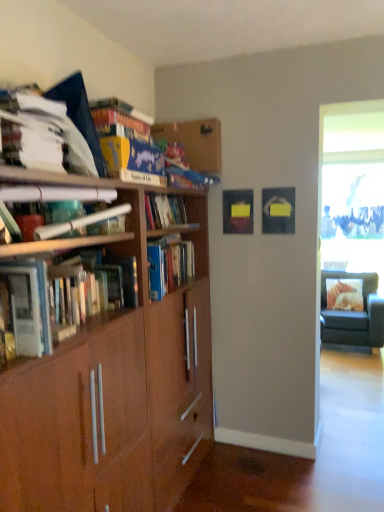
Question: Is brown wood bookcase at left bigger or smaller than white paper at upper left, which is counted as the 2th book, starting from the top?

Choices:
 (A) big
 (B) small

Answer: (A)

Question: Is point pos(46,349) positioned closer to the camera than point pos(13,124)?

Choices:
 (A) closer
 (B) farther

Answer: (A)

Question: Which is nearer to the hardcover books at left, which appears as the 1th book when ordered from the bottom?

Choices:
 (A) wooden bookshelf at upper center
 (B) black fabric chair at right
 (C) brown wood bookcase at left
 (D) matte blue book at upper center, which ranks as the fourth book in bottom-to-top order
 (E) matte brown paper at upper left, the second book from the bottom

Answer: (E)

Question: Which is nearer to the hardcover books at left, which ranks as the 4th book in top-to-bottom order?

Choices:
 (A) black fabric chair at right
 (B) matte brown paper at upper left, the 3th book in the top-to-bottom sequence
 (C) matte blue book at upper center, placed as the first book when sorted from top to bottom
 (D) white paper at upper left, which is counted as the 2th book, starting from the top
 (E) brown wood bookcase at left

Answer: (B)